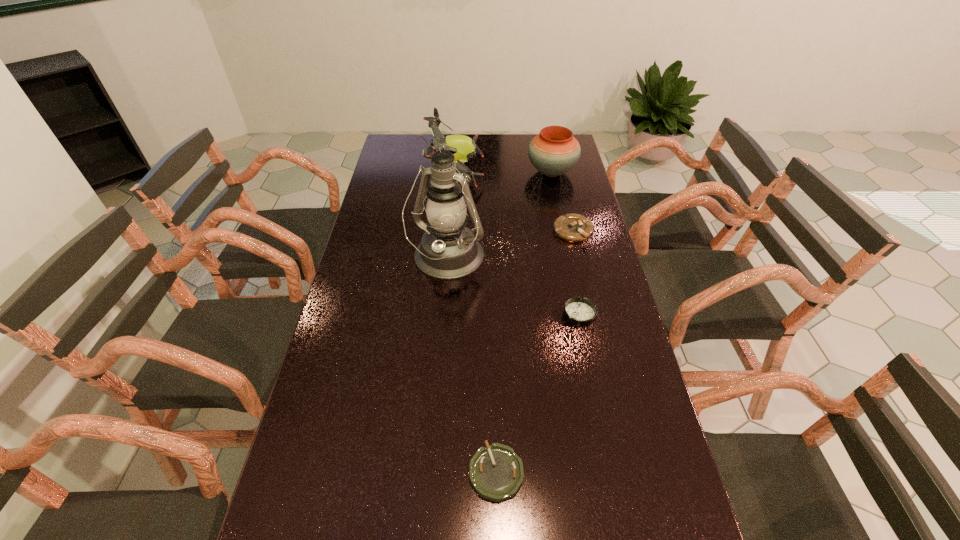
Find the location of a particular element. free region that satisfies the following two spatial constraints: 1. on the front-facing side of the shortest object; 2. on the right side of the fifth shortest object is located at coordinates (433, 472).